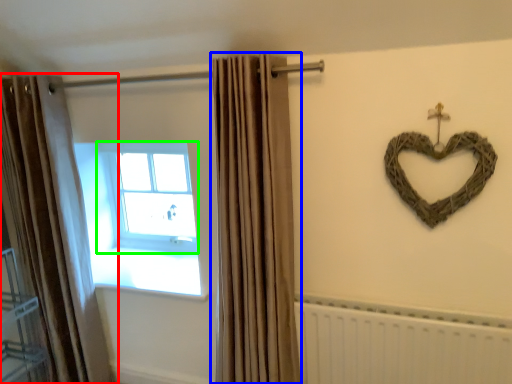
Question: Considering the real-world distances, which object is closest to curtain (highlighted by a red box)? curtain (highlighted by a blue box) or window (highlighted by a green box).

Choices:
 (A) curtain
 (B) window

Answer: (B)